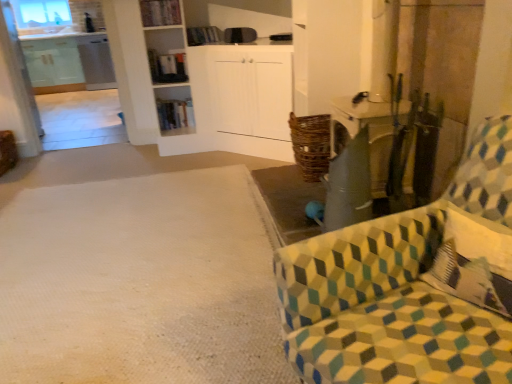
Question: Is transparent glass window at upper left thinner than white textured carpet at lower left?

Choices:
 (A) yes
 (B) no

Answer: (A)

Question: Considering the relative sizes of transparent glass window at upper left and white textured carpet at lower left in the image provided, is transparent glass window at upper left wider than white textured carpet at lower left?

Choices:
 (A) yes
 (B) no

Answer: (B)

Question: Is transparent glass window at upper left smaller than white textured carpet at lower left?

Choices:
 (A) yes
 (B) no

Answer: (A)

Question: From the image's perspective, is transparent glass window at upper left located beneath white textured carpet at lower left?

Choices:
 (A) yes
 (B) no

Answer: (B)

Question: Can you confirm if transparent glass window at upper left is positioned to the left of white textured carpet at lower left?

Choices:
 (A) yes
 (B) no

Answer: (A)

Question: Does transparent glass window at upper left have a lesser height compared to white textured carpet at lower left?

Choices:
 (A) yes
 (B) no

Answer: (B)

Question: From a real-world perspective, is white textured carpet at lower left located beneath wooden bookshelf at upper center, positioned as the first shelf in front-to-back order?

Choices:
 (A) no
 (B) yes

Answer: (B)

Question: Is white textured carpet at lower left looking in the opposite direction of wooden bookshelf at upper center, acting as the first shelf starting from the top?

Choices:
 (A) no
 (B) yes

Answer: (A)

Question: Considering the relative sizes of white textured carpet at lower left and wooden bookshelf at upper center, which ranks as the 2th shelf in bottom-to-top order, in the image provided, is white textured carpet at lower left shorter than wooden bookshelf at upper center, which ranks as the 2th shelf in bottom-to-top order,?

Choices:
 (A) yes
 (B) no

Answer: (A)

Question: Does white textured carpet at lower left have a lesser width compared to wooden bookshelf at upper center, positioned as the first shelf in front-to-back order?

Choices:
 (A) no
 (B) yes

Answer: (A)

Question: Is the depth of white textured carpet at lower left less than that of wooden bookshelf at upper center, which ranks as the 2th shelf in bottom-to-top order?

Choices:
 (A) no
 (B) yes

Answer: (B)

Question: From the image's perspective, is white textured carpet at lower left on top of wooden bookshelf at upper center, positioned as the first shelf in front-to-back order?

Choices:
 (A) no
 (B) yes

Answer: (A)

Question: Would you say patterned fabric chair at right is outside wooden bookshelf at center, the second shelf positioned from the top?

Choices:
 (A) yes
 (B) no

Answer: (A)